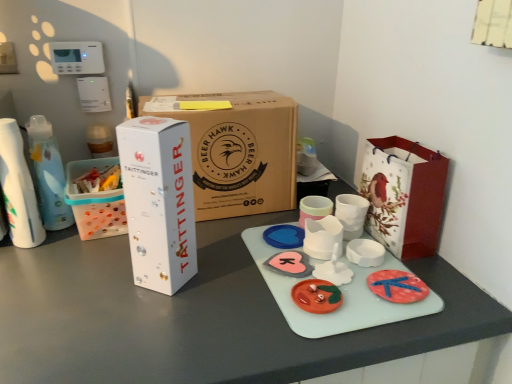
Where is `free space that is in between white glossy cup at center, which is counted as the 3th toy, starting from the back, and white glossy box at left, marked as the 1th box in a front-to-back arrangement`? free space that is in between white glossy cup at center, which is counted as the 3th toy, starting from the back, and white glossy box at left, marked as the 1th box in a front-to-back arrangement is located at coordinates (228, 279).